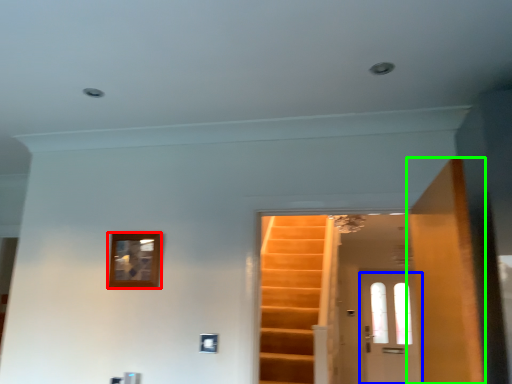
Question: Which is farther away from picture frame (highlighted by a red box)? door (highlighted by a blue box) or door (highlighted by a green box)?

Choices:
 (A) door
 (B) door

Answer: (A)